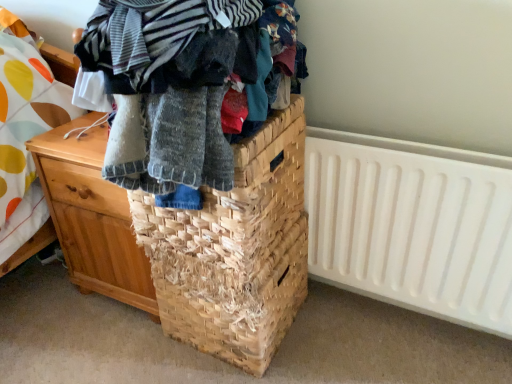
Identify the location of vacant region to the left of natural fiber basket at center. The width and height of the screenshot is (512, 384). (123, 351).